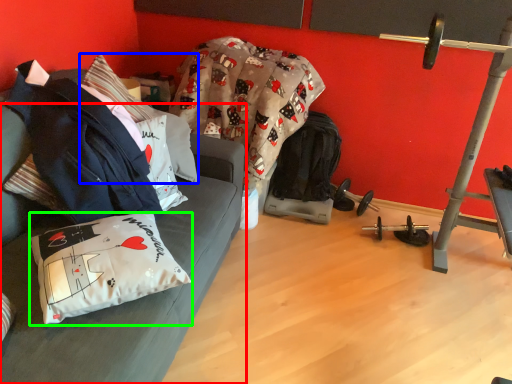
Question: Which object is the farthest from studio couch (highlighted by a red box)? Choose among these: pillow (highlighted by a blue box) or pillow (highlighted by a green box).

Choices:
 (A) pillow
 (B) pillow

Answer: (A)